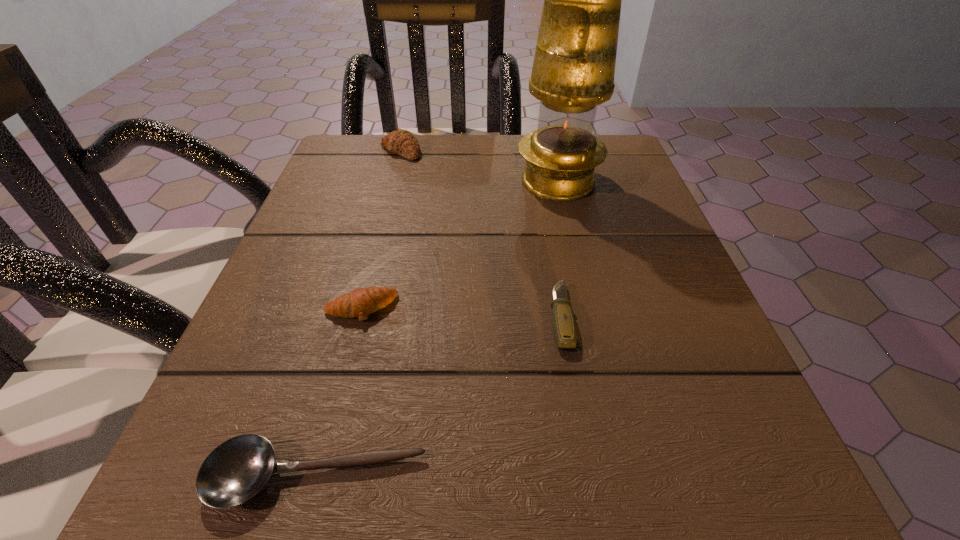
The height and width of the screenshot is (540, 960). I want to click on vacant region located on the back of the pocketknife, so coord(542,211).

Locate an element on the screen. This screenshot has height=540, width=960. vacant space located on the back of the ladle is located at coordinates (361, 307).

Locate an element on the screen. oil lamp that is at the far edge is located at coordinates click(x=573, y=71).

Identify the location of crescent roll located in the far edge section of the desktop. The width and height of the screenshot is (960, 540). (402, 142).

Identify the location of object present at the near edge. The width and height of the screenshot is (960, 540). (235, 471).

What are the coordinates of `ladle that is at the left edge` in the screenshot? It's located at (235, 471).

Identify the location of object present at the right edge. (573, 71).

This screenshot has width=960, height=540. Identify the location of object at the far left corner. (402, 142).

The image size is (960, 540). Identify the location of object that is at the near left corner. (235, 471).

Identify the location of object located in the far right corner section of the desktop. (573, 71).